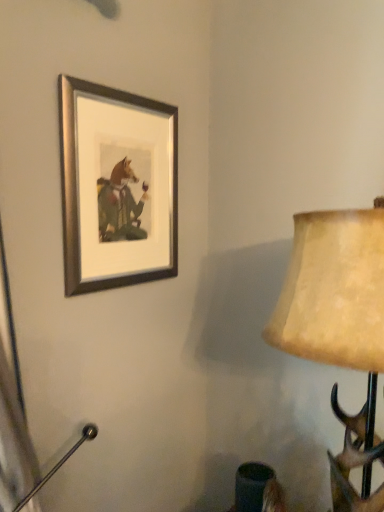
Question: Does matte beige lampshade at right have a greater height compared to silver/metallic picture frame at upper left?

Choices:
 (A) yes
 (B) no

Answer: (A)

Question: From a real-world perspective, does matte beige lampshade at right sit lower than silver/metallic picture frame at upper left?

Choices:
 (A) yes
 (B) no

Answer: (A)

Question: Is matte beige lampshade at right facing towards silver/metallic picture frame at upper left?

Choices:
 (A) no
 (B) yes

Answer: (A)

Question: Is matte beige lampshade at right to the left of silver/metallic picture frame at upper left from the viewer's perspective?

Choices:
 (A) no
 (B) yes

Answer: (A)

Question: From the image's perspective, is matte beige lampshade at right over silver/metallic picture frame at upper left?

Choices:
 (A) yes
 (B) no

Answer: (B)

Question: Is matte beige lampshade at right in front of silver/metallic picture frame at upper left?

Choices:
 (A) yes
 (B) no

Answer: (A)

Question: Is silver/metallic picture frame at upper left oriented towards matte beige lampshade at right?

Choices:
 (A) yes
 (B) no

Answer: (A)

Question: Is silver/metallic picture frame at upper left at the left side of matte beige lampshade at right?

Choices:
 (A) no
 (B) yes

Answer: (B)

Question: From a real-world perspective, is silver/metallic picture frame at upper left physically above matte beige lampshade at right?

Choices:
 (A) no
 (B) yes

Answer: (B)

Question: Is silver/metallic picture frame at upper left wider than matte beige lampshade at right?

Choices:
 (A) no
 (B) yes

Answer: (A)

Question: Are silver/metallic picture frame at upper left and matte beige lampshade at right making contact?

Choices:
 (A) no
 (B) yes

Answer: (A)

Question: From the image's perspective, is silver/metallic picture frame at upper left located beneath matte beige lampshade at right?

Choices:
 (A) yes
 (B) no

Answer: (B)

Question: Looking at the image, does silver/metallic picture frame at upper left seem bigger or smaller compared to matte beige lampshade at right?

Choices:
 (A) small
 (B) big

Answer: (A)